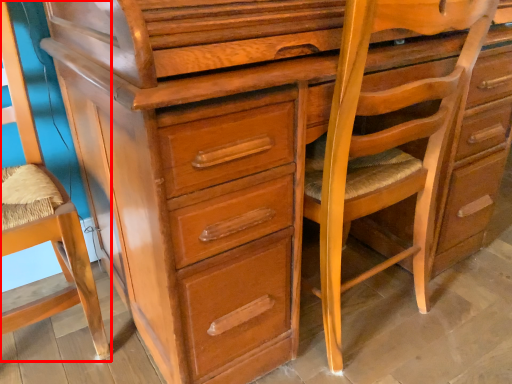
Question: Where is swivel chair (annotated by the red box) located in relation to rocking chair in the image?

Choices:
 (A) left
 (B) right

Answer: (A)